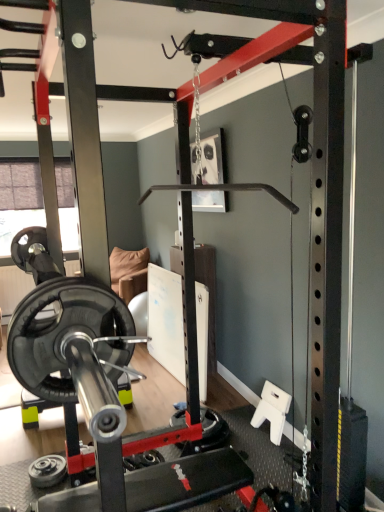
How much space does black rubber wheel at center, acting as the second wheel starting from the front, occupy horizontally?

14.07 inches.

Identify the location of black rubber barbell at center. (104, 396).

Considering the sizes of objects black rubber barbell at center and black rubber wheel at center, placed as the first wheel when sorted from top to bottom, in the image provided, who is taller, black rubber barbell at center or black rubber wheel at center, placed as the first wheel when sorted from top to bottom,?

black rubber wheel at center, placed as the first wheel when sorted from top to bottom.

What's the angular difference between black rubber barbell at center and black rubber wheel at center, acting as the second wheel starting from the front,'s facing directions?

The facing directions of black rubber barbell at center and black rubber wheel at center, acting as the second wheel starting from the front, are 179 degrees apart.

Considering the positions of objects black rubber barbell at center and black rubber wheel at center, placed as the first wheel when sorted from top to bottom, in the image provided, who is behind, black rubber barbell at center or black rubber wheel at center, placed as the first wheel when sorted from top to bottom,?

black rubber wheel at center, placed as the first wheel when sorted from top to bottom, is more distant.

From the image's perspective, between black rubber barbell at center and black rubber wheel at center, the 1th wheel when ordered from right to left, which one is located above?

black rubber barbell at center.

Which of these two, black rubber wheel at center, the 1th wheel when ordered from right to left, or black rubber weight plate at lower left, placed as the first wheel when sorted from front to back, is bigger?

black rubber wheel at center, the 1th wheel when ordered from right to left, is bigger.

Does black rubber wheel at center, the 1th wheel when ordered from right to left, have a greater width compared to black rubber weight plate at lower left, the second wheel in the back-to-front sequence?

Yes, black rubber wheel at center, the 1th wheel when ordered from right to left, is wider than black rubber weight plate at lower left, the second wheel in the back-to-front sequence.

How different are the orientations of black rubber wheel at center, placed as the first wheel when sorted from top to bottom, and black rubber weight plate at lower left, placed as the first wheel when sorted from front to back, in degrees?

0.367 degrees separate the facing orientations of black rubber wheel at center, placed as the first wheel when sorted from top to bottom, and black rubber weight plate at lower left, placed as the first wheel when sorted from front to back.

Is point (177, 420) closer or farther from the camera than point (48, 467)?

Point (177, 420) is farther from the camera than point (48, 467).

Would you consider black rubber barbell at center to be distant from black rubber weight plate at lower left, marked as the first wheel in a bottom-to-top arrangement?

No, black rubber barbell at center is in close proximity to black rubber weight plate at lower left, marked as the first wheel in a bottom-to-top arrangement.

Image resolution: width=384 pixels, height=512 pixels. I want to click on the 1st wheel behind the black rubber barbell at center, starting your count from the anchor, so click(x=47, y=471).

Can you confirm if black rubber barbell at center is taller than black rubber weight plate at lower left, positioned as the 2th wheel in right-to-left order?

Yes.

From the picture: Would you say black rubber weight plate at lower left, which is the first wheel from left to right, is outside black rubber barbell at center?

Actually, black rubber weight plate at lower left, which is the first wheel from left to right, is at least partially inside black rubber barbell at center.

From a real-world perspective, starting from the black rubber barbell at center, which wheel is the 1st one vertically above it? Please provide its 2D coordinates.

[(47, 471)]

Does black rubber weight plate at lower left, which is the 2th wheel in top-to-bottom order, have a smaller size compared to black rubber barbell at center?

Indeed, black rubber weight plate at lower left, which is the 2th wheel in top-to-bottom order, has a smaller size compared to black rubber barbell at center.

Is black rubber weight plate at lower left, marked as the first wheel in a bottom-to-top arrangement, directly adjacent to black rubber barbell at center?

black rubber weight plate at lower left, marked as the first wheel in a bottom-to-top arrangement, and black rubber barbell at center are not in contact.

Considering the sizes of objects black rubber weight plate at lower left, which is the first wheel from left to right, and black rubber wheel at center, the second wheel viewed from the left, in the image provided, who is smaller, black rubber weight plate at lower left, which is the first wheel from left to right, or black rubber wheel at center, the second wheel viewed from the left,?

black rubber weight plate at lower left, which is the first wheel from left to right.

Considering their positions, is black rubber weight plate at lower left, which is the first wheel from left to right, located in front of or behind black rubber wheel at center, the 1th wheel when ordered from right to left?

Visually, black rubber weight plate at lower left, which is the first wheel from left to right, is located in front of black rubber wheel at center, the 1th wheel when ordered from right to left.

From the image's perspective, does black rubber weight plate at lower left, marked as the first wheel in a bottom-to-top arrangement, appear lower than black rubber wheel at center, placed as the first wheel when sorted from top to bottom?

Yes.

Which is closer to the camera, (223,423) or (26,350)?

Point (26,350)

Which of these two, black rubber wheel at center, the second wheel viewed from the left, or black rubber barbell at center, is wider?

With larger width is black rubber barbell at center.

From a real-world perspective, relative to black rubber barbell at center, is black rubber wheel at center, which is counted as the first wheel, starting from the back, vertically above or below?

black rubber wheel at center, which is counted as the first wheel, starting from the back, is above black rubber barbell at center.

Identify the location of wheel that is the 2nd object located behind the black rubber barbell at center. (212, 425).

You are a GUI agent. You are given a task and a screenshot of the screen. Output one action in this format:
    pyautogui.click(x=<x>, y=<y>)
    Task: Click on the wheel that is below the black rubber wheel at center, acting as the second wheel starting from the front (from the image's perspective)
    
    Given the screenshot: What is the action you would take?
    pyautogui.click(x=47, y=471)

When comparing their distances from black rubber wheel at center, the 1th wheel when ordered from right to left, does black rubber barbell at center or black rubber weight plate at lower left, which is the 2th wheel in top-to-bottom order, seem further?

The object further to black rubber wheel at center, the 1th wheel when ordered from right to left, is black rubber weight plate at lower left, which is the 2th wheel in top-to-bottom order.

Which object lies further to the anchor point black rubber weight plate at lower left, placed as the first wheel when sorted from front to back, black rubber wheel at center, marked as the 2th wheel in a bottom-to-top arrangement, or black rubber barbell at center?

black rubber wheel at center, marked as the 2th wheel in a bottom-to-top arrangement, is positioned further to the anchor black rubber weight plate at lower left, placed as the first wheel when sorted from front to back.

Estimate the real-world distances between objects in this image. Which object is further from black rubber weight plate at lower left, marked as the first wheel in a bottom-to-top arrangement, black rubber barbell at center or black rubber wheel at center, acting as the second wheel starting from the front?

The object further to black rubber weight plate at lower left, marked as the first wheel in a bottom-to-top arrangement, is black rubber wheel at center, acting as the second wheel starting from the front.

Considering their positions, is black rubber weight plate at lower left, the second wheel in the back-to-front sequence, positioned further to black rubber barbell at center than black rubber wheel at center, the second wheel viewed from the left?

Among the two, black rubber weight plate at lower left, the second wheel in the back-to-front sequence, is located further to black rubber barbell at center.

When comparing their distances from black rubber barbell at center, does black rubber wheel at center, placed as the first wheel when sorted from top to bottom, or black rubber weight plate at lower left, which is the first wheel from left to right, seem further?

black rubber weight plate at lower left, which is the first wheel from left to right, is positioned further to the anchor black rubber barbell at center.

Considering their positions, is black rubber weight plate at lower left, which is the first wheel from left to right, positioned closer to black rubber wheel at center, which is counted as the first wheel, starting from the back, than black rubber barbell at center?

Among the two, black rubber barbell at center is located nearer to black rubber wheel at center, which is counted as the first wheel, starting from the back.

Find the location of `wheel between black rubber barbell at center and black rubber wheel at center, acting as the second wheel starting from the front, in the front-back direction`. wheel between black rubber barbell at center and black rubber wheel at center, acting as the second wheel starting from the front, in the front-back direction is located at coordinates (47, 471).